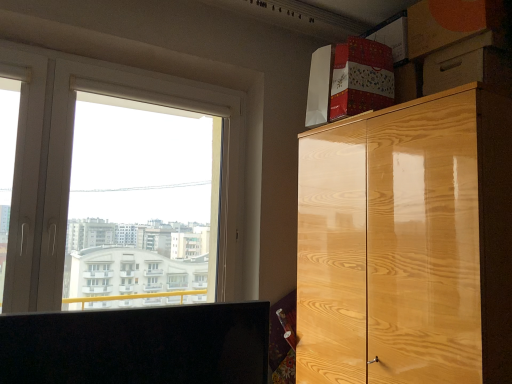
Question: Would you say white plastic window at upper left is part of orange cardboard box at upper right's contents?

Choices:
 (A) no
 (B) yes

Answer: (A)

Question: Considering the relative positions of orange cardboard box at upper right and white plastic window at upper left in the image provided, is orange cardboard box at upper right to the left of white plastic window at upper left from the viewer's perspective?

Choices:
 (A) yes
 (B) no

Answer: (B)

Question: Is there a large distance between orange cardboard box at upper right and white plastic window at upper left?

Choices:
 (A) no
 (B) yes

Answer: (B)

Question: Would you say orange cardboard box at upper right is outside white plastic window at upper left?

Choices:
 (A) yes
 (B) no

Answer: (A)

Question: Considering the relative sizes of orange cardboard box at upper right and white plastic window at upper left in the image provided, is orange cardboard box at upper right thinner than white plastic window at upper left?

Choices:
 (A) no
 (B) yes

Answer: (A)

Question: Is orange cardboard box at upper right aimed at white plastic window at upper left?

Choices:
 (A) no
 (B) yes

Answer: (A)

Question: From a real-world perspective, is white plastic window at upper left over glossy wood cabinet at upper right?

Choices:
 (A) no
 (B) yes

Answer: (B)

Question: Is white plastic window at upper left turned away from glossy wood cabinet at upper right?

Choices:
 (A) yes
 (B) no

Answer: (B)

Question: From a real-world perspective, is white plastic window at upper left beneath glossy wood cabinet at upper right?

Choices:
 (A) yes
 (B) no

Answer: (B)

Question: Is white plastic window at upper left behind glossy wood cabinet at upper right?

Choices:
 (A) no
 (B) yes

Answer: (B)

Question: Is glossy wood cabinet at upper right inside white plastic window at upper left?

Choices:
 (A) yes
 (B) no

Answer: (B)

Question: Can you confirm if white plastic window at upper left is positioned to the left of glossy wood cabinet at upper right?

Choices:
 (A) no
 (B) yes

Answer: (B)

Question: From the image's perspective, is orange cardboard box at upper right above glossy wood cabinet at upper right?

Choices:
 (A) yes
 (B) no

Answer: (A)